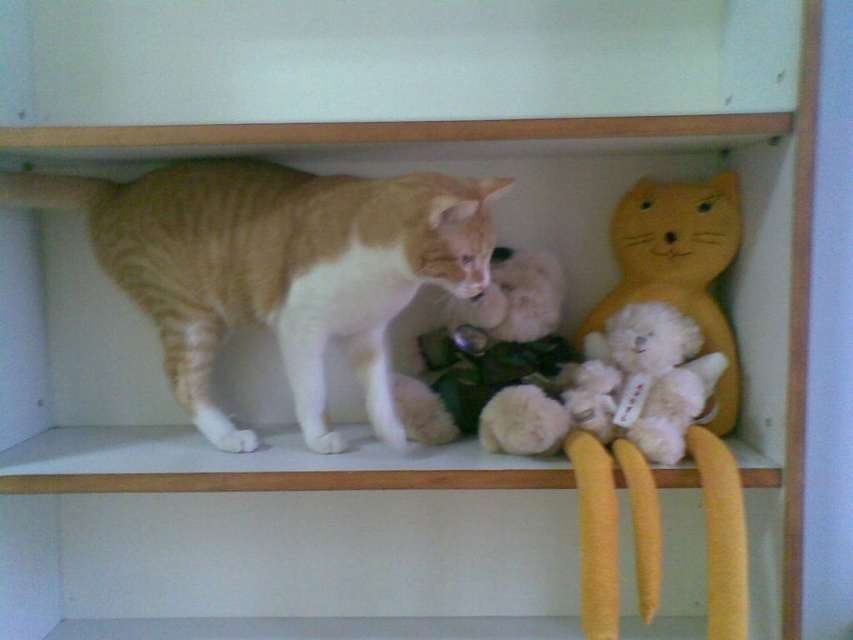
Question: Which object is farther from the camera taking this photo?

Choices:
 (A) fluffy white teddy bear at right
 (B) orange tabby cat at left

Answer: (A)

Question: Which object appears farthest from the camera in this image?

Choices:
 (A) fluffy white teddy bear at center
 (B) fluffy white teddy bear at right
 (C) orange tabby cat at left
 (D) yellow plush cat at right

Answer: (D)

Question: Does fluffy white teddy bear at center come in front of yellow plush cat at right?

Choices:
 (A) yes
 (B) no

Answer: (A)

Question: Does fluffy white teddy bear at center come in front of yellow plush cat at right?

Choices:
 (A) no
 (B) yes

Answer: (B)

Question: Is the position of fluffy white teddy bear at center more distant than that of yellow plush cat at right?

Choices:
 (A) yes
 (B) no

Answer: (B)

Question: Which of the following is the farthest from the observer?

Choices:
 (A) click(x=653, y=193)
 (B) click(x=664, y=369)
 (C) click(x=445, y=380)
 (D) click(x=482, y=205)

Answer: (C)